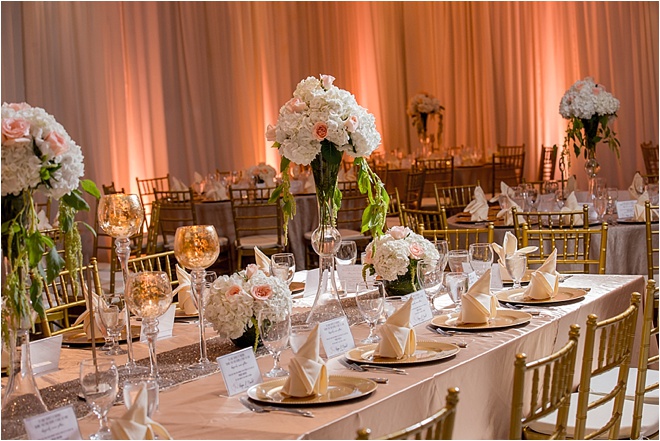
Locate an element on the screen. This screenshot has width=660, height=441. plates on front table is located at coordinates (94, 337), (180, 313), (294, 288), (338, 398), (424, 351), (513, 316), (558, 292).